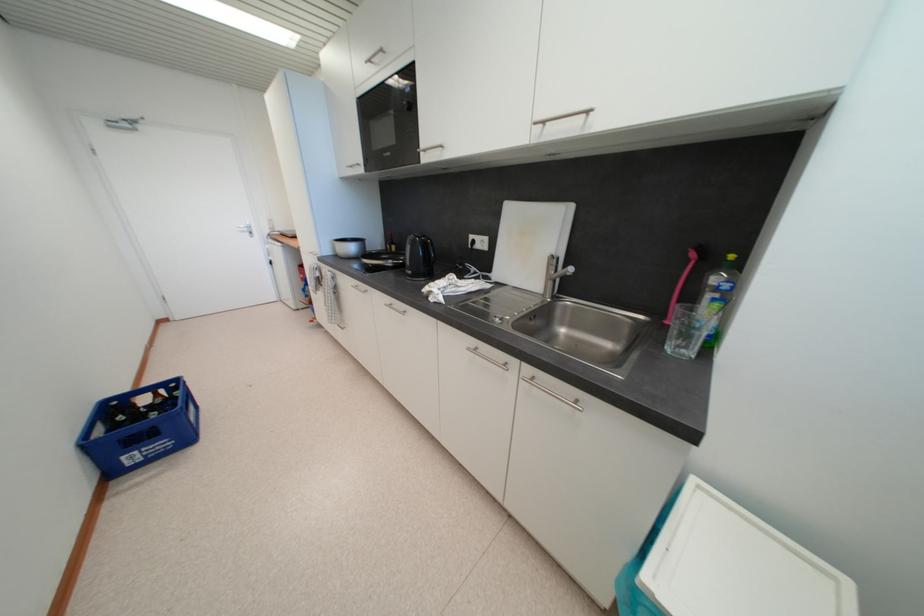
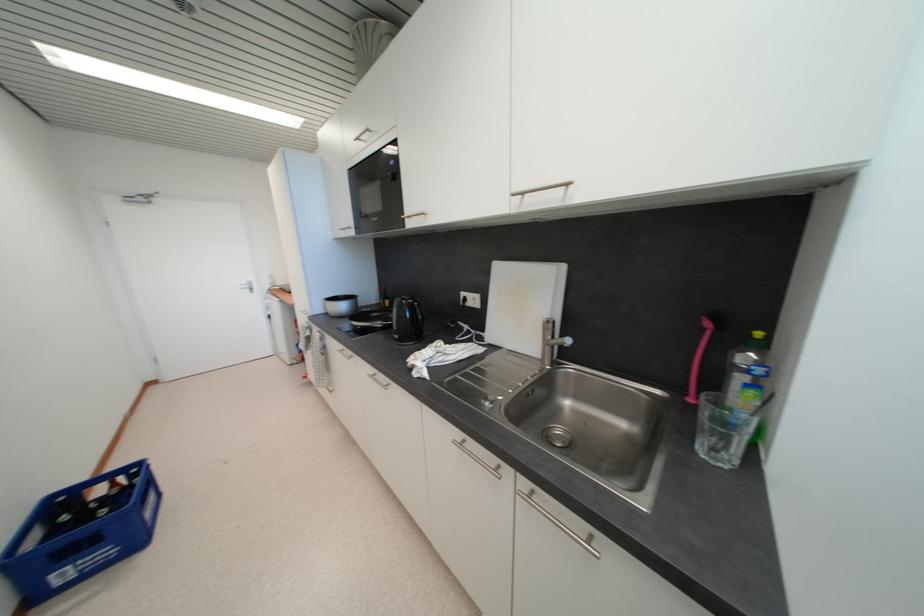
Where in the second image is the point corresponding to [341,257] from the first image?

(332, 315)